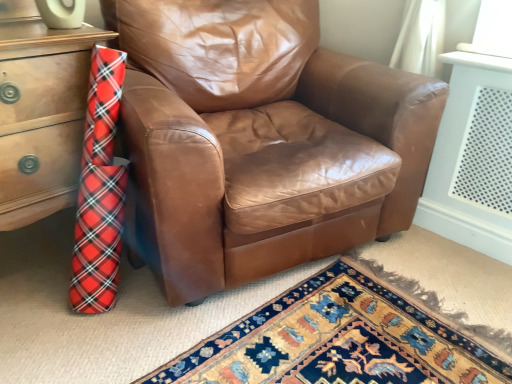
What are the coordinates of `brown leather chair at center` in the screenshot? It's located at (262, 140).

The height and width of the screenshot is (384, 512). What do you see at coordinates (262, 140) in the screenshot?
I see `brown leather chair at center` at bounding box center [262, 140].

This screenshot has width=512, height=384. Identify the location of wooden chest of drawers at left. (41, 113).

Describe the element at coordinates (41, 113) in the screenshot. Image resolution: width=512 pixels, height=384 pixels. I see `wooden chest of drawers at left` at that location.

Find the location of a particular element. This screenshot has height=384, width=512. brown leather chair at center is located at coordinates (262, 140).

Can you confirm if wooden chest of drawers at left is positioned to the right of brown leather chair at center?

In fact, wooden chest of drawers at left is to the left of brown leather chair at center.

Considering their positions, is wooden chest of drawers at left located in front of or behind brown leather chair at center?

Visually, wooden chest of drawers at left is located behind brown leather chair at center.

Is point (71, 176) closer or farther from the camera than point (398, 201)?

Point (71, 176).

From the image's perspective, would you say wooden chest of drawers at left is shown under brown leather chair at center?

Yes, from the image's perspective, wooden chest of drawers at left is beneath brown leather chair at center.

From a real-world perspective, is wooden chest of drawers at left on top of brown leather chair at center?

Actually, wooden chest of drawers at left is physically below brown leather chair at center in the real world.

In terms of width, does wooden chest of drawers at left look wider or thinner when compared to brown leather chair at center?

Clearly, wooden chest of drawers at left has less width compared to brown leather chair at center.

Considering the sizes of objects wooden chest of drawers at left and brown leather chair at center in the image provided, who is taller, wooden chest of drawers at left or brown leather chair at center?

Standing taller between the two is brown leather chair at center.

Is wooden chest of drawers at left bigger or smaller than brown leather chair at center?

Considering their sizes, wooden chest of drawers at left takes up less space than brown leather chair at center.

Would you say brown leather chair at center is part of wooden chest of drawers at left's contents?

That's incorrect, brown leather chair at center is not inside wooden chest of drawers at left.

Is wooden chest of drawers at left far away from brown leather chair at center?

No, wooden chest of drawers at left is not far away from brown leather chair at center.

Is wooden chest of drawers at left oriented towards brown leather chair at center?

No, wooden chest of drawers at left is not aimed at brown leather chair at center.

How many degrees apart are the facing directions of wooden chest of drawers at left and brown leather chair at center?

17.2 degrees.

Where is `chair above the wooden chest of drawers at left (from the image's perspective)`? Image resolution: width=512 pixels, height=384 pixels. chair above the wooden chest of drawers at left (from the image's perspective) is located at coordinates (x=262, y=140).

Between brown leather chair at center and wooden chest of drawers at left, which one appears on the left side from the viewer's perspective?

From the viewer's perspective, wooden chest of drawers at left appears more on the left side.

Considering the relative positions of brown leather chair at center and wooden chest of drawers at left in the image provided, is brown leather chair at center behind wooden chest of drawers at left?

No, brown leather chair at center is in front of wooden chest of drawers at left.

Which is closer to the camera, [176,96] or [68,128]?

Point [176,96] is positioned farther from the camera compared to point [68,128].

From the image's perspective, which is below, brown leather chair at center or wooden chest of drawers at left?

wooden chest of drawers at left is shown below in the image.

From a real-world perspective, is brown leather chair at center on top of wooden chest of drawers at left?

Yes, from a real-world perspective, brown leather chair at center is on top of wooden chest of drawers at left.

In terms of width, does brown leather chair at center look wider or thinner when compared to wooden chest of drawers at left?

In the image, brown leather chair at center appears to be wider than wooden chest of drawers at left.

From their relative heights in the image, would you say brown leather chair at center is taller or shorter than wooden chest of drawers at left?

brown leather chair at center is taller than wooden chest of drawers at left.

Can you confirm if brown leather chair at center is bigger than wooden chest of drawers at left?

Yes.

Is brown leather chair at center inside or outside of wooden chest of drawers at left?

brown leather chair at center exists outside the volume of wooden chest of drawers at left.

Would you consider brown leather chair at center to be distant from wooden chest of drawers at left?

Actually, brown leather chair at center and wooden chest of drawers at left are a little close together.

Is brown leather chair at center aimed at wooden chest of drawers at left?

No, brown leather chair at center is not oriented towards wooden chest of drawers at left.

What's the angular difference between brown leather chair at center and wooden chest of drawers at left's facing directions?

The angular difference between brown leather chair at center and wooden chest of drawers at left is 17.2 degrees.

In order to click on chair that is above the wooden chest of drawers at left (from a real-world perspective) in this screenshot , I will do `click(262, 140)`.

At what (x,y) coordinates should I click in order to perform the action: click on the chest of drawers beneath the brown leather chair at center (from a real-world perspective). Please return your answer as a coordinate pair (x, y). This screenshot has width=512, height=384. Looking at the image, I should click on (41, 113).

I want to click on chest of drawers on the left of brown leather chair at center, so click(x=41, y=113).